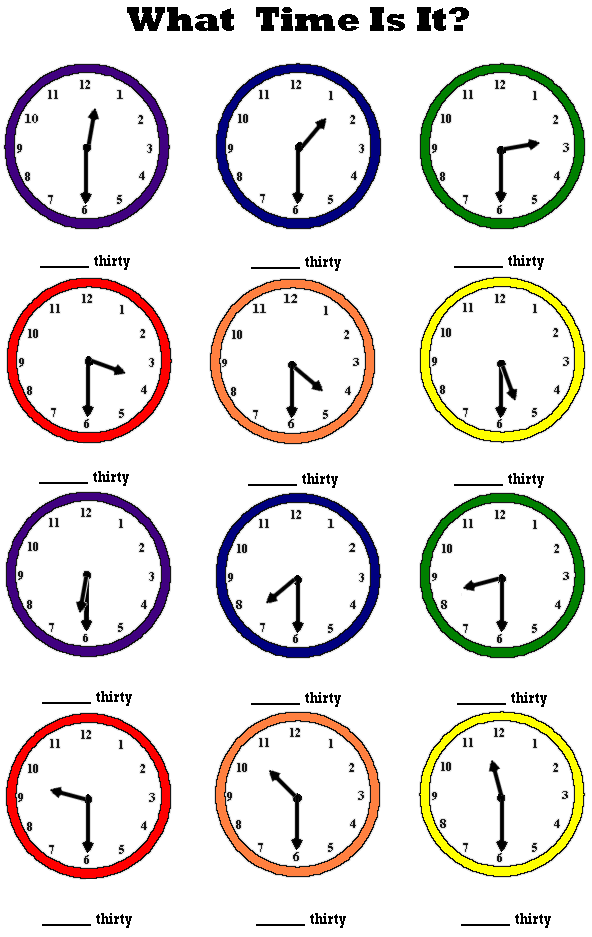
The width and height of the screenshot is (592, 937). In order to click on blue clock in this screenshot , I will do `click(118, 120)`, `click(96, 558)`, `click(283, 576)`, `click(281, 137)`.